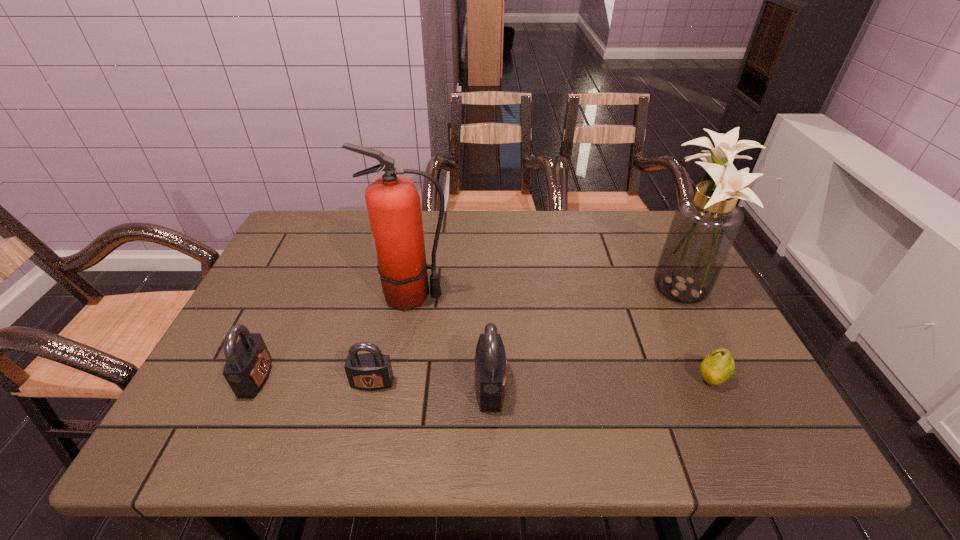
Identify the location of the fourth tallest object. The width and height of the screenshot is (960, 540). (248, 364).

Locate an element on the screen. the leftmost padlock is located at coordinates (248, 364).

Image resolution: width=960 pixels, height=540 pixels. Identify the location of the shortest padlock. (370, 371).

At what (x,y) coordinates should I click in order to perform the action: click on the second shortest object. Please return your answer as a coordinate pair (x, y). Looking at the image, I should click on (370, 371).

The width and height of the screenshot is (960, 540). In order to click on the fourth object from left to right in this screenshot , I will do `click(490, 358)`.

Where is `flower arrangement`? This screenshot has height=540, width=960. flower arrangement is located at coordinates (705, 224).

Locate an element on the screen. This screenshot has width=960, height=540. fire extinguisher is located at coordinates (393, 203).

At what (x,y) coordinates should I click in order to perform the action: click on pear. Please return your answer as a coordinate pair (x, y). The image size is (960, 540). Looking at the image, I should click on (718, 366).

Locate an element on the screen. This screenshot has width=960, height=540. vacant space located on the front of the second shortest padlock near the keyhole is located at coordinates (320, 378).

Where is `vacant space located on the front of the fourth object from left to right near the keyhole`? vacant space located on the front of the fourth object from left to right near the keyhole is located at coordinates (586, 387).